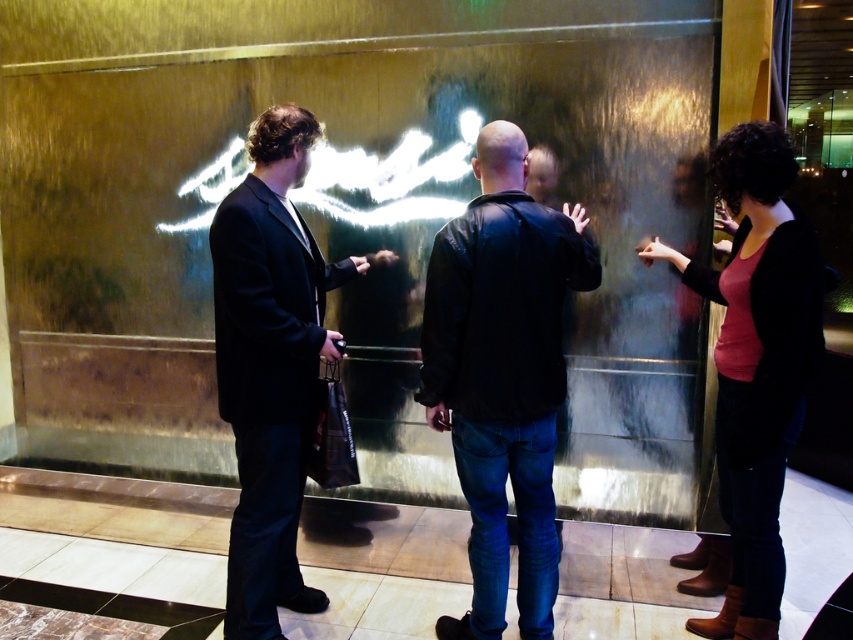
In the scene shown: You are a photographer setting up a shoot in the lobby. You need to position a tripod so that both the black leather jacket at center and the matte black suit at left are fully visible in the reflection on the metallic wall. Considering their heights, which object will appear shorter in the reflection?

The black leather jacket at center will appear shorter in the reflection because it is not as tall as the matte black suit at left.

You are a fashion designer observing the three people in the scene. You need to determine which clothing item is wider between the black leather jacket at center and the matte black sweater at right. Which one is wider?

The black leather jacket at center is wider than the matte black sweater at right according to the description.